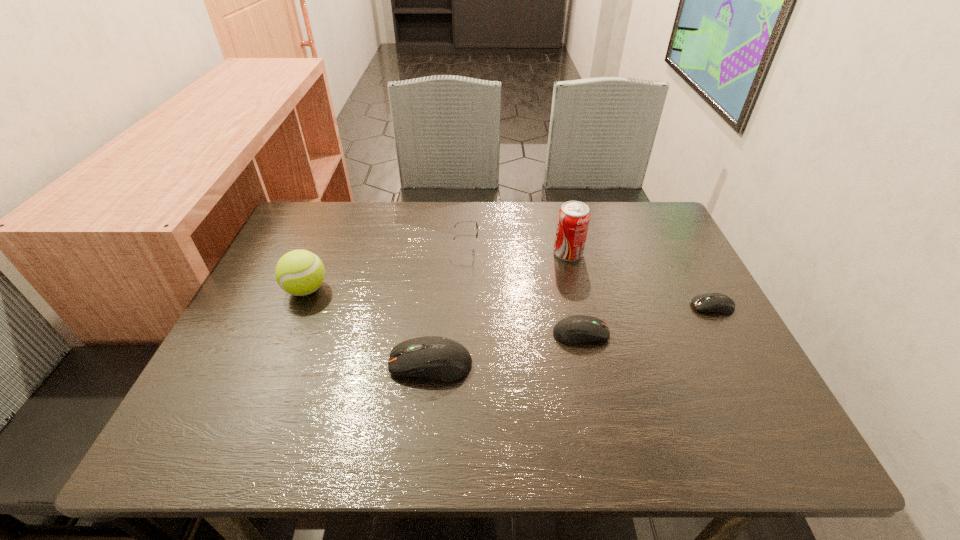
The height and width of the screenshot is (540, 960). Identify the location of free space between the soda can and the leftmost object. (437, 271).

Identify the location of vacant area that lies between the second nearest computer equipment and the fifth shortest object. This screenshot has height=540, width=960. (444, 312).

The image size is (960, 540). In order to click on object that can be found as the closest to the rightmost computer equipment in this screenshot , I will do `click(575, 329)`.

Find the location of a particular element. The image size is (960, 540). the second closest object to the leftmost object is located at coordinates (466, 221).

At what (x,y) coordinates should I click in order to perform the action: click on the closest computer equipment relative to the fifth shortest object. Please return your answer as a coordinate pair (x, y). The height and width of the screenshot is (540, 960). Looking at the image, I should click on (440, 358).

Select which computer equipment appears as the closest to the third tallest object. Please provide its 2D coordinates. Your answer should be formatted as a tuple, i.e. [(x, y)], where the tuple contains the x and y coordinates of a point satisfying the conditions above.

[(575, 329)]

Identify the location of free point that satisfies the following two spatial constraints: 1. in front of the lenses of the sunglasses; 2. on the right side of the tallest object. This screenshot has height=540, width=960. (467, 253).

This screenshot has height=540, width=960. I want to click on free space that satisfies the following two spatial constraints: 1. on the back side of the tallest object; 2. in front of the lenses of the sunglasses, so click(566, 245).

Locate an element on the screen. vacant position in the image that satisfies the following two spatial constraints: 1. on the front side of the soda can; 2. on the button of the nearest object is located at coordinates (594, 363).